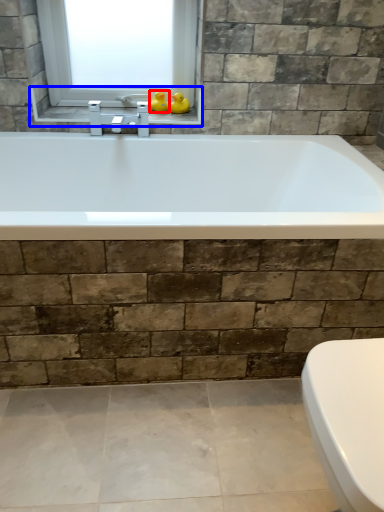
Question: Among these objects, which one is farthest to the camera, duck (highlighted by a red box) or window sill (highlighted by a blue box)?

Choices:
 (A) duck
 (B) window sill

Answer: (A)